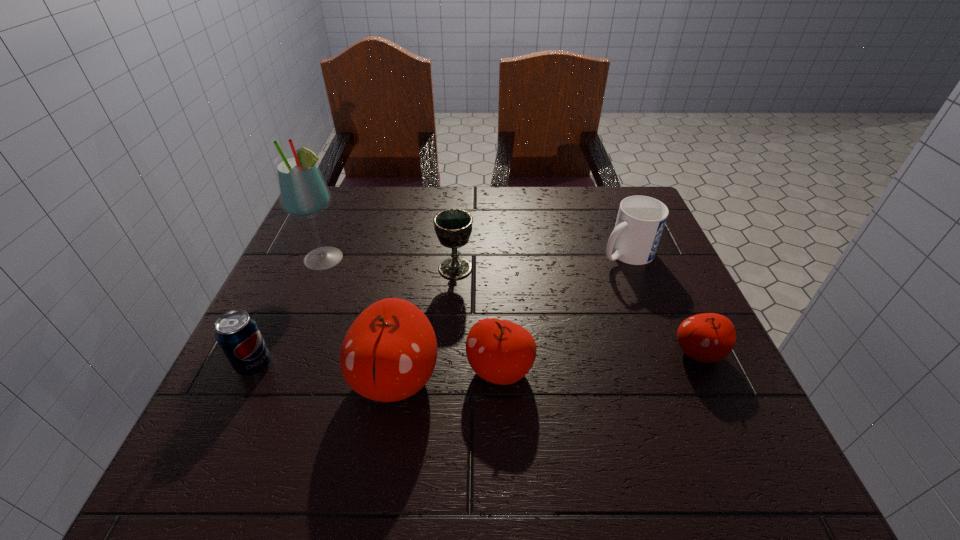
In order to click on the leftmost apple in this screenshot , I will do `click(389, 353)`.

You are a GUI agent. You are given a task and a screenshot of the screen. Output one action in this format:
    pyautogui.click(x=<x>, y=<y>)
    Task: Click on the tallest apple
    The image size is (960, 540).
    Given the screenshot: What is the action you would take?
    pyautogui.click(x=389, y=353)

Where is `the second shortest apple`? The height and width of the screenshot is (540, 960). the second shortest apple is located at coordinates (499, 351).

The width and height of the screenshot is (960, 540). Identify the location of the shortest object. 709,337.

The image size is (960, 540). Identify the location of the shortest apple. (709, 337).

At what (x,y) coordinates should I click in order to perform the action: click on mug. Please return your answer as a coordinate pair (x, y). Image resolution: width=960 pixels, height=540 pixels. Looking at the image, I should click on (640, 221).

Find the location of `chalice`. chalice is located at coordinates [x=453, y=227].

Locate an element on the screen. The width and height of the screenshot is (960, 540). soda can is located at coordinates (238, 334).

Identify the location of the tallest object. Image resolution: width=960 pixels, height=540 pixels. (302, 190).

You are a GUI agent. You are given a task and a screenshot of the screen. Output one action in this format:
    pyautogui.click(x=<x>, y=<y>)
    Task: Click on the vacant space situated 0.200m on the left of the tallest apple
    This screenshot has width=960, height=540.
    Given the screenshot: What is the action you would take?
    pyautogui.click(x=241, y=379)